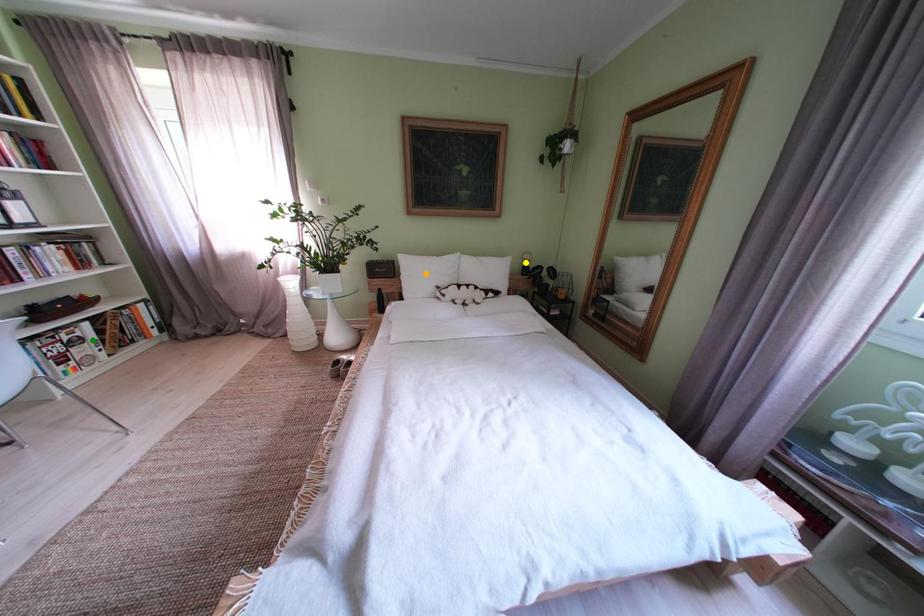
Based on the photo, order these from nearest to farthest:
orange point
green point
yellow point

green point
orange point
yellow point